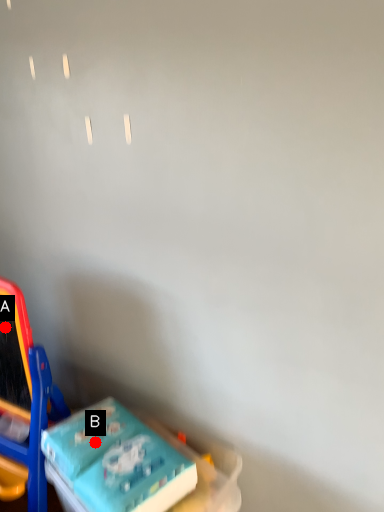
Question: Two points are circled on the image, labeled by A and B beside each circle. Which point appears farthest from the camera in this image?

Choices:
 (A) A is further
 (B) B is further

Answer: (A)